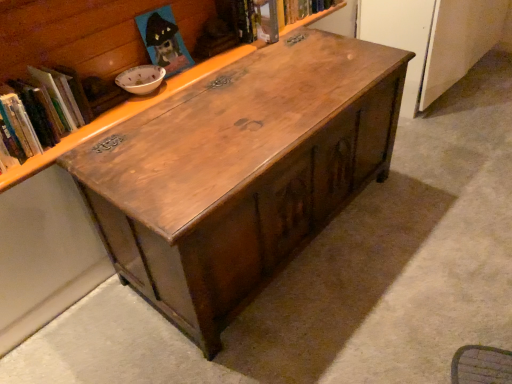
Question: Does wooden chest at center have a lesser height compared to hardcover book at upper center, positioned as the 1th book in top-to-bottom order?

Choices:
 (A) no
 (B) yes

Answer: (A)

Question: Considering the relative sizes of wooden chest at center and hardcover book at upper center, marked as the 2th book in a front-to-back arrangement, in the image provided, is wooden chest at center thinner than hardcover book at upper center, marked as the 2th book in a front-to-back arrangement,?

Choices:
 (A) no
 (B) yes

Answer: (A)

Question: From a real-world perspective, is wooden chest at center located higher than hardcover book at upper center, marked as the 2th book in a front-to-back arrangement?

Choices:
 (A) no
 (B) yes

Answer: (B)

Question: Does wooden chest at center have a greater height compared to hardcover book at upper center, acting as the second book starting from the left?

Choices:
 (A) yes
 (B) no

Answer: (A)

Question: Is wooden chest at center looking in the opposite direction of hardcover book at upper center, positioned as the 1th book in top-to-bottom order?

Choices:
 (A) yes
 (B) no

Answer: (A)

Question: Are wooden chest at center and hardcover book at upper center, marked as the 2th book in a front-to-back arrangement, beside each other?

Choices:
 (A) no
 (B) yes

Answer: (A)

Question: Considering the relative sizes of wooden chest at center and hardcover book at upper left, which ranks as the second book in top-to-bottom order, in the image provided, is wooden chest at center shorter than hardcover book at upper left, which ranks as the second book in top-to-bottom order,?

Choices:
 (A) yes
 (B) no

Answer: (B)

Question: Considering the relative positions of wooden chest at center and hardcover book at upper left, the first book in the left-to-right sequence, in the image provided, is wooden chest at center to the right of hardcover book at upper left, the first book in the left-to-right sequence, from the viewer's perspective?

Choices:
 (A) no
 (B) yes

Answer: (B)

Question: Can we say wooden chest at center lies outside hardcover book at upper left, which appears as the first book when ordered from the bottom?

Choices:
 (A) no
 (B) yes

Answer: (B)

Question: Does wooden chest at center turn towards hardcover book at upper left, arranged as the second book when viewed from the back?

Choices:
 (A) yes
 (B) no

Answer: (B)

Question: From a real-world perspective, is wooden chest at center on top of hardcover book at upper left, the first book in the left-to-right sequence?

Choices:
 (A) yes
 (B) no

Answer: (B)

Question: Is hardcover book at upper left, which appears as the first book when ordered from the bottom, a part of wooden chest at center?

Choices:
 (A) no
 (B) yes

Answer: (A)

Question: Does wooden chest at center turn towards hardcover book at upper center, acting as the second book starting from the left?

Choices:
 (A) no
 (B) yes

Answer: (A)